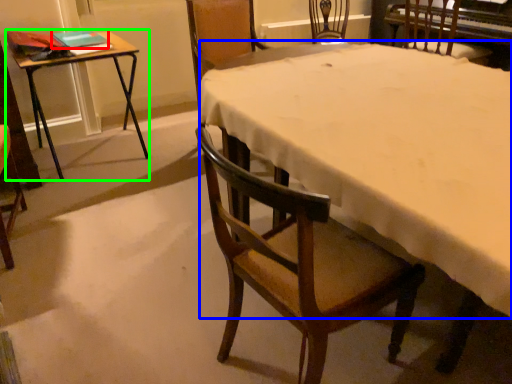
Question: Estimate the real-world distances between objects in this image. Which object is closer to book (highlighted by a red box), tablecloth (highlighted by a blue box) or table (highlighted by a green box)?

Choices:
 (A) tablecloth
 (B) table

Answer: (B)